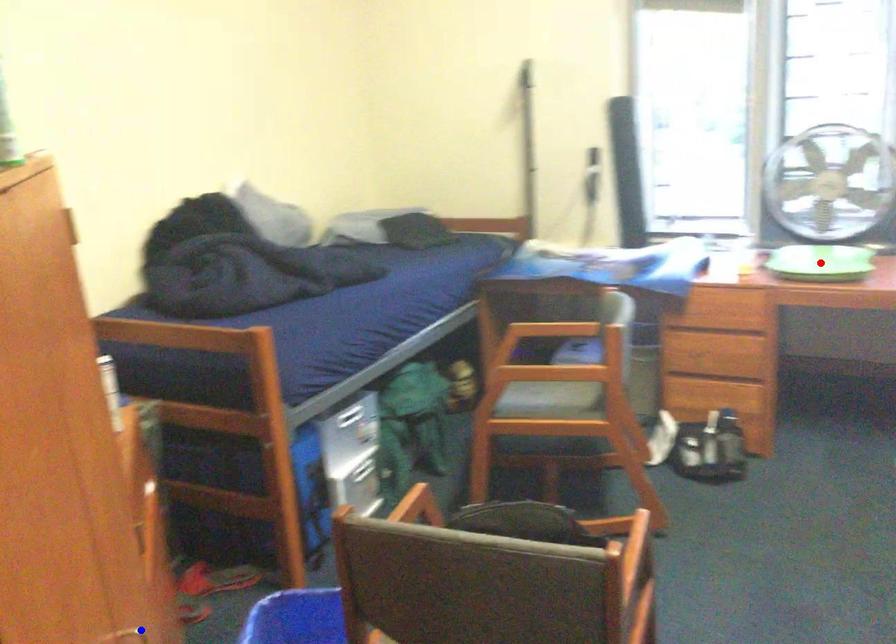
Question: Two points are marked on the image. Which point is closer to the camera?

Choices:
 (A) Blue point is closer.
 (B) Red point is closer.

Answer: (A)